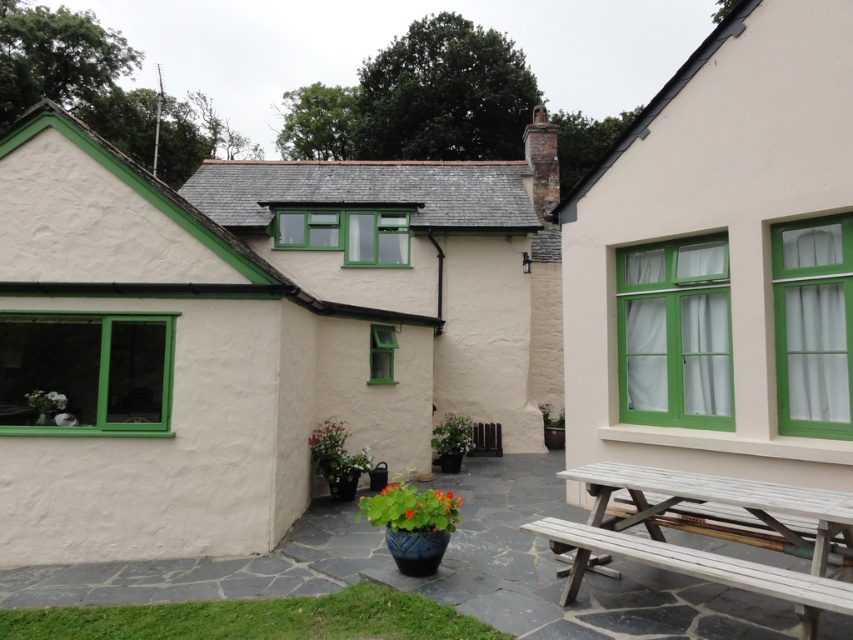
Question: Which of these objects is positioned farthest from the white stucco cottage at left?

Choices:
 (A) light brown wooden bench at lower right
 (B) white wooden picnic table at lower right
 (C) white wood picnic table at right

Answer: (C)

Question: Does white wood picnic table at right appear over white wooden picnic table at lower right?

Choices:
 (A) yes
 (B) no

Answer: (A)

Question: Which object is farther from the camera taking this photo?

Choices:
 (A) white wooden picnic table at lower right
 (B) white stucco cottage at left
 (C) light brown wooden bench at lower right
 (D) white wood picnic table at right

Answer: (B)

Question: Which object is farther from the camera taking this photo?

Choices:
 (A) white stucco cottage at left
 (B) white wood picnic table at right
 (C) light brown wooden bench at lower right
 (D) white wooden picnic table at lower right

Answer: (A)

Question: Can you confirm if white stucco cottage at left is wider than light brown wooden bench at lower right?

Choices:
 (A) no
 (B) yes

Answer: (B)

Question: Is white wooden picnic table at lower right bigger than light brown wooden bench at lower right?

Choices:
 (A) yes
 (B) no

Answer: (A)